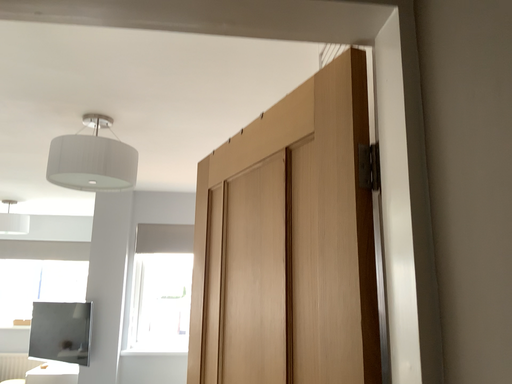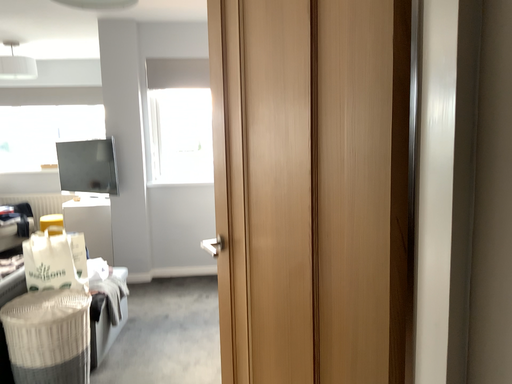
Question: How did the camera likely rotate when shooting the video?

Choices:
 (A) rotated upward
 (B) rotated downward

Answer: (B)